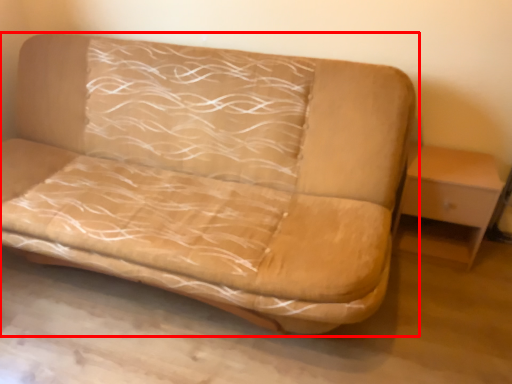
Question: From the image's perspective, considering the relative positions of studio couch (annotated by the red box) and table in the image provided, where is studio couch (annotated by the red box) located with respect to the staircase?

Choices:
 (A) above
 (B) below

Answer: (A)